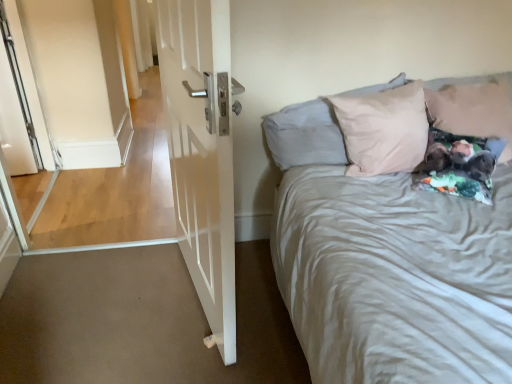
Question: Relative to light pink fabric pillow at upper right, the second pillow in the right-to-left sequence, is white glossy door at left in front or behind?

Choices:
 (A) behind
 (B) front

Answer: (B)

Question: In terms of height, does white glossy door at left look taller or shorter compared to light pink fabric pillow at upper right, the second pillow in the right-to-left sequence?

Choices:
 (A) tall
 (B) short

Answer: (A)

Question: Estimate the real-world distances between objects in this image. Which object is closer to the light pink fabric pillow at upper right, arranged as the 1th pillow when viewed from the left?

Choices:
 (A) light pink fabric pillow at upper right, which is the second pillow in left-to-right order
 (B) white glossy door at left

Answer: (A)

Question: Which of these objects is positioned closest to the light pink fabric pillow at upper right, arranged as the 1th pillow when viewed from the left?

Choices:
 (A) light pink fabric pillow at upper right, which is the second pillow in left-to-right order
 (B) white glossy door at left

Answer: (A)